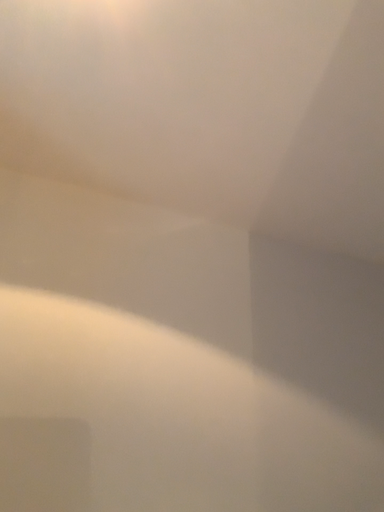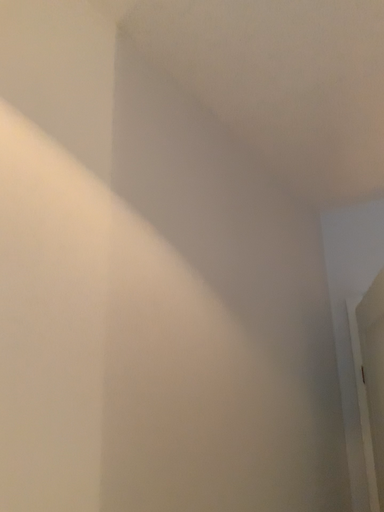
Question: Which way did the camera rotate in the video?

Choices:
 (A) rotated left
 (B) rotated right

Answer: (B)